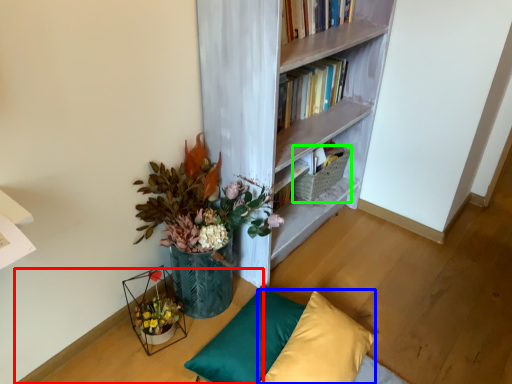
Question: Which is farther away from table (highlighted by a red box)? pillow (highlighted by a blue box) or basket (highlighted by a green box)?

Choices:
 (A) pillow
 (B) basket

Answer: (B)